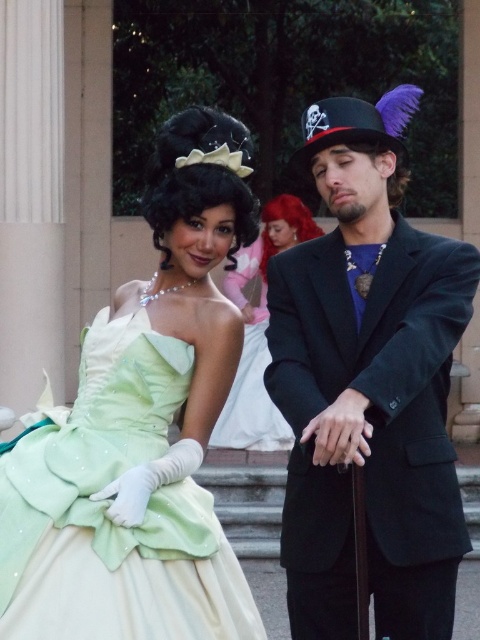
Who is higher up, vivid red wig at upper center or brown fuzzy wig at upper right?

vivid red wig at upper center is above.

Image resolution: width=480 pixels, height=640 pixels. What do you see at coordinates (291, 216) in the screenshot?
I see `vivid red wig at upper center` at bounding box center [291, 216].

Is point (294, 216) more distant than point (388, 188)?

Yes.

Find the location of `vivid red wig at upper center`. vivid red wig at upper center is located at coordinates (291, 216).

Is lime satin dress at left positioned at the back of vivid red wig at upper center?

No.

What do you see at coordinates (108, 506) in the screenshot?
I see `lime satin dress at left` at bounding box center [108, 506].

Locate an element on the screen. The image size is (480, 640). lime satin dress at left is located at coordinates (108, 506).

Who is positioned more to the right, matte green dress at center or vivid red wig at upper center?

vivid red wig at upper center

Can you confirm if matte green dress at center is taller than vivid red wig at upper center?

No, matte green dress at center is not taller than vivid red wig at upper center.

Find the location of a particular element. The image size is (480, 640). matte green dress at center is located at coordinates point(260,332).

Where is `matte green dress at center`? The image size is (480, 640). matte green dress at center is located at coordinates (260, 332).